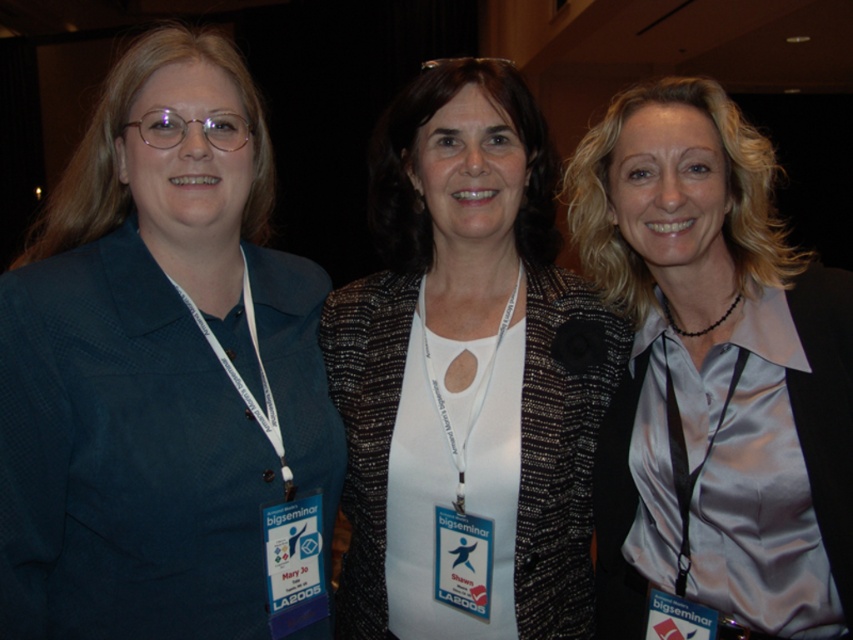
Is matte blue blazer at left to the left of satin light gray blouse at center from the viewer's perspective?

Indeed, matte blue blazer at left is positioned on the left side of satin light gray blouse at center.

Is point (85, 627) behind point (721, 483)?

No.

Where is `matte blue blazer at left`? matte blue blazer at left is located at coordinates (161, 372).

Consider the image. Does speckled woolen jacket at center lie behind satin light gray blouse at center?

Yes, it is behind satin light gray blouse at center.

Which is in front, point (538, 556) or point (747, 429)?

Positioned in front is point (747, 429).

Identify the location of speckled woolen jacket at center. pyautogui.click(x=468, y=369).

What are the coordinates of `speckled woolen jacket at center` in the screenshot? It's located at (468, 369).

Who is taller, matte blue blazer at left or speckled woolen jacket at center?

Standing taller between the two is speckled woolen jacket at center.

Does matte blue blazer at left appear under speckled woolen jacket at center?

No.

Does point (44, 380) come behind point (527, 518)?

No, (44, 380) is closer to viewer.

Image resolution: width=853 pixels, height=640 pixels. What are the coordinates of `matte blue blazer at left` in the screenshot? It's located at (161, 372).